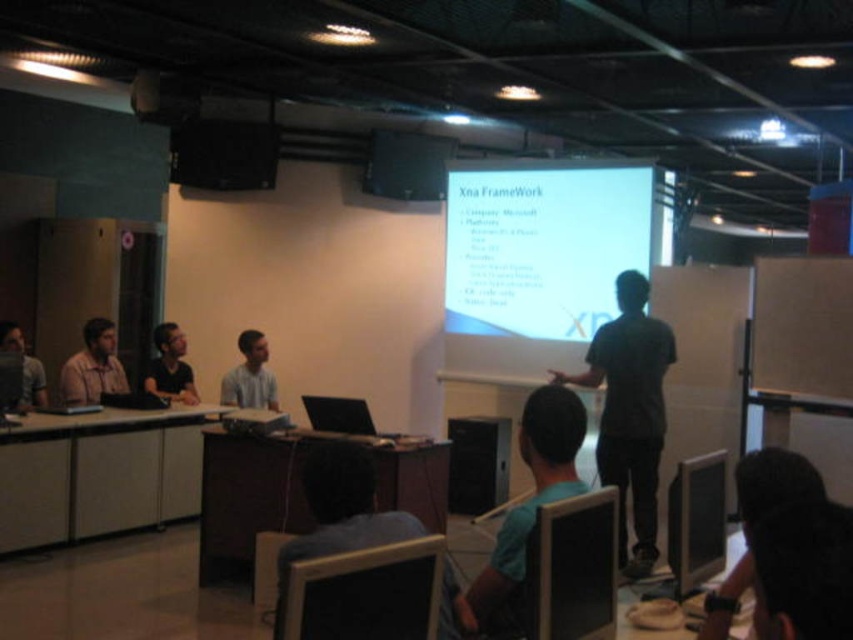
Question: Does blue shirt at center have a lesser width compared to black plastic speaker at center?

Choices:
 (A) yes
 (B) no

Answer: (A)

Question: Is white matte projection screen at upper center positioned in front of dark gray shirt at center?

Choices:
 (A) no
 (B) yes

Answer: (A)

Question: Which of the following is the farthest from the observer?

Choices:
 (A) (714, 465)
 (B) (267, 179)
 (C) (242, 385)

Answer: (B)

Question: Among these objects, which one is nearest to the camera?

Choices:
 (A) matte gray shirt at left
 (B) black plastic monitor at lower center
 (C) matte black shirt at center

Answer: (B)

Question: Does blue fabric shirt at center have a lesser width compared to black matte speaker at upper center?

Choices:
 (A) no
 (B) yes

Answer: (B)

Question: Estimate the real-world distances between objects in this image. Which object is closer to the black glossy monitor at lower center?

Choices:
 (A) matte black shirt at center
 (B) blue fabric shirt at center
 (C) matte brown shirt at left

Answer: (B)